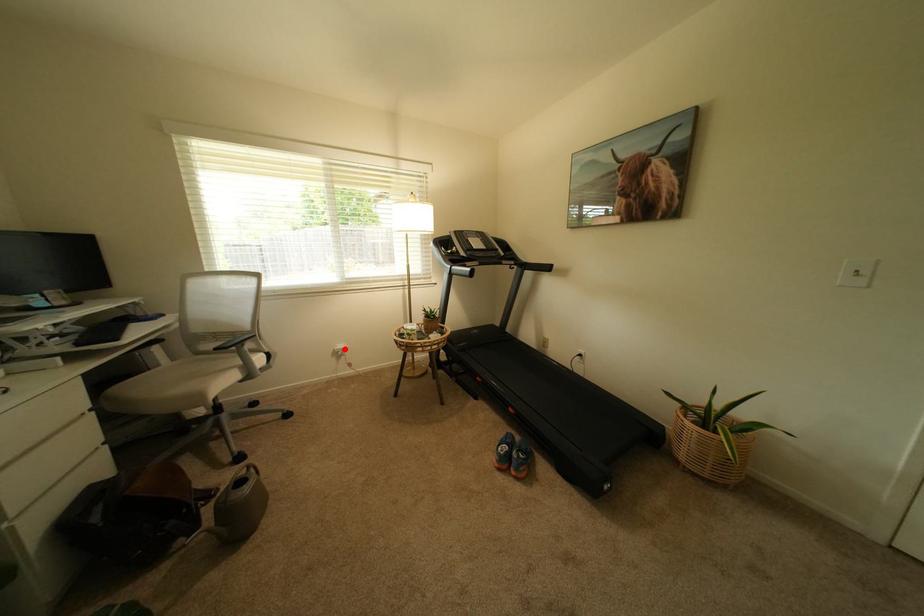
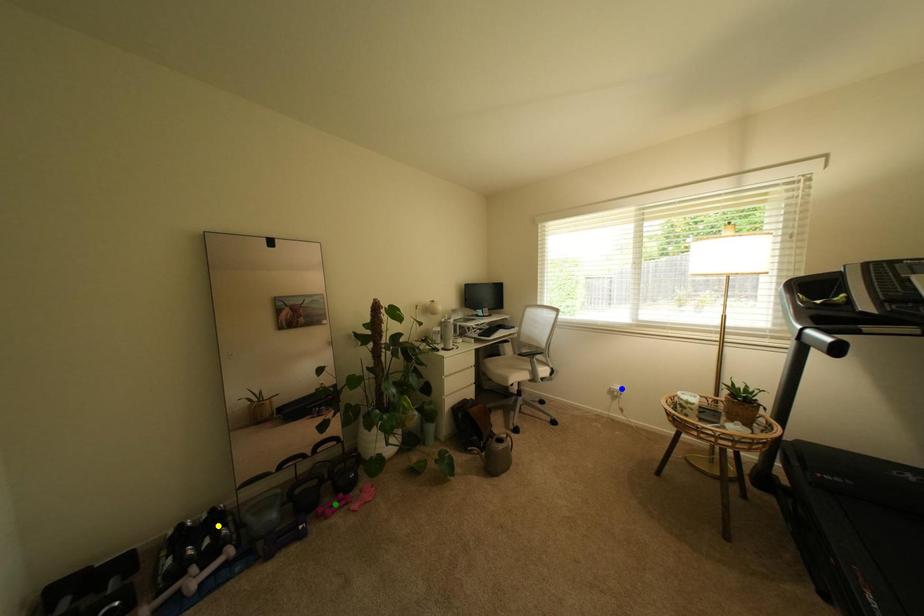
Question: I am providing you with two images of the same scene from different viewpoints. A red point is marked on the first image. You are given multiple points on the second image. Which point in image 2 is actually the same real-world point as the red point in image 1?

Choices:
 (A) blue point
 (B) yellow point
 (C) green point

Answer: (A)